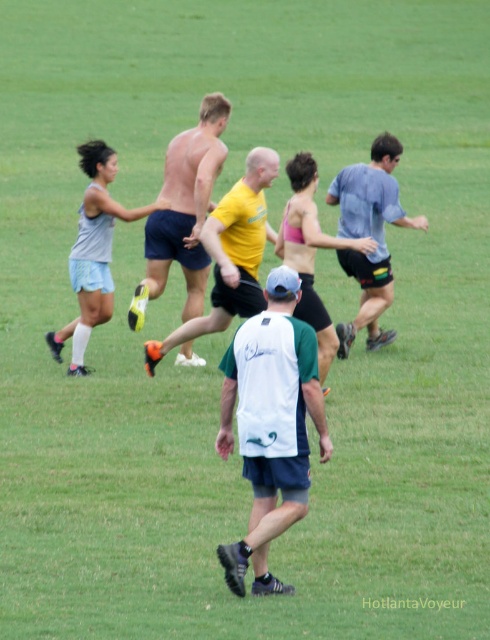
Question: Does white/green fabric shirt at center have a lesser width compared to light blue fabric shirt at right?

Choices:
 (A) no
 (B) yes

Answer: (A)

Question: Which object is positioned farthest from the white/green fabric shirt at center?

Choices:
 (A) shiny blue shorts at center
 (B) light blue fabric shirt at right

Answer: (B)

Question: Which object is positioned farthest from the light blue fabric shirt at right?

Choices:
 (A) shiny blue shorts at center
 (B) yellow matte shirt at center
 (C) white/green fabric shirt at center

Answer: (C)

Question: Which object appears closest to the camera in this image?

Choices:
 (A) yellow matte shirt at center
 (B) shiny blue shorts at center

Answer: (A)

Question: Is white/green fabric shirt at center positioned in front of yellow matte shirt at center?

Choices:
 (A) yes
 (B) no

Answer: (A)

Question: Is white/green fabric shirt at center bigger than yellow matte shirt at center?

Choices:
 (A) no
 (B) yes

Answer: (B)